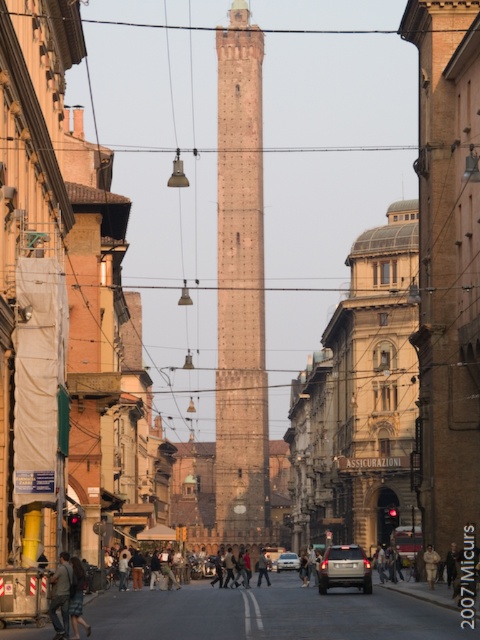
You are a tourist standing on the street and want to take a photo of the brown stone tower at center without any cars blocking the view. Is the satin silver sedan at center currently blocking the view of the tower?

The satin silver sedan at center is behind brown stone tower at center, so it is not blocking the view of the tower. You can take the photo without any obstruction.

Based on the photo, you are an architect visiting the Italian city and notice the brown stone tower at center and the denim jacket at lower left in the scene. Which object is bigger in size?

The brown stone tower at center is larger in size compared to the denim jacket at lower left.

Consider the image. You are a tourist standing at the lower left corner of the street. You see the brown stone tower at center and the denim jacket at lower left. Which object is wider?

The brown stone tower at center is wider than the denim jacket at lower left according to the description.